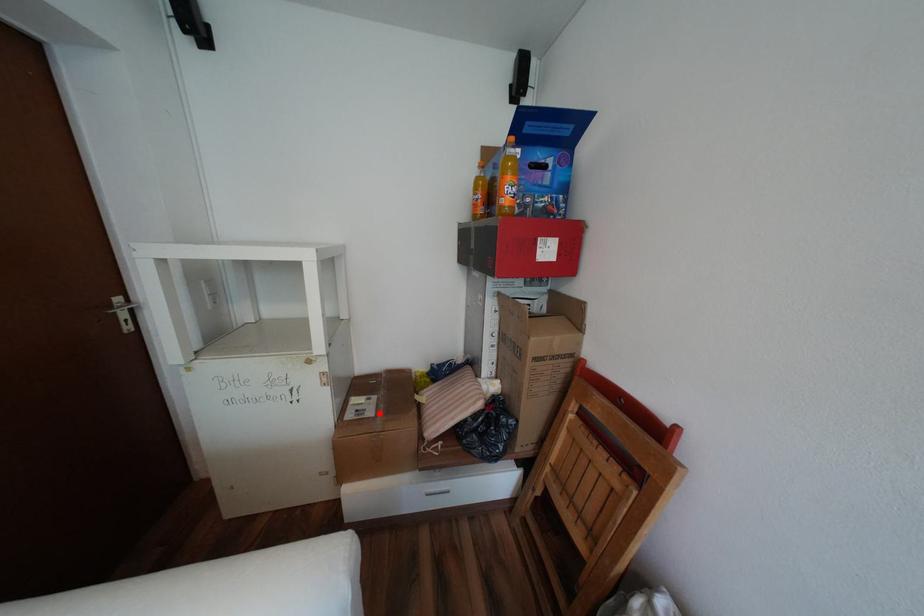
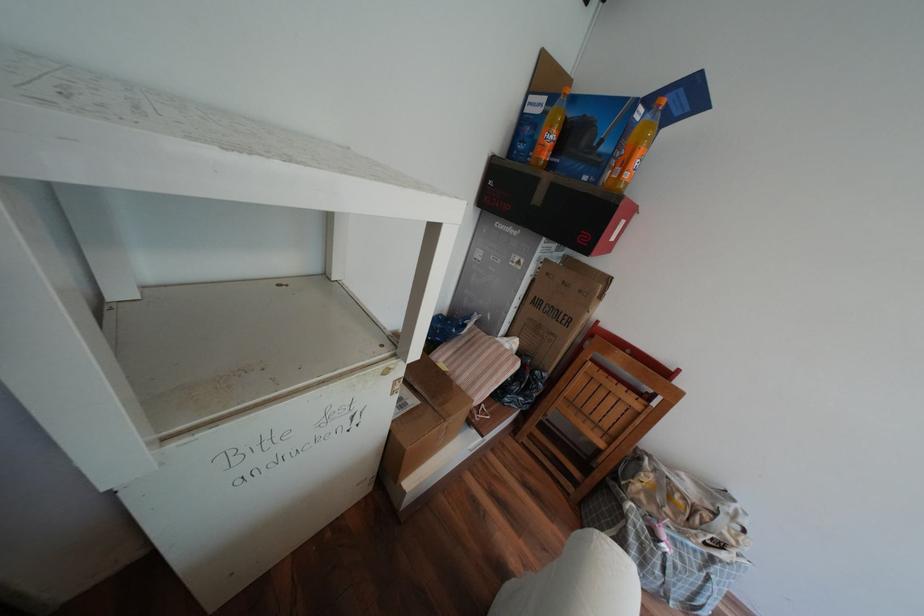
In the second image, find the point that corresponds to the highlighted location in the first image.

(422, 400)